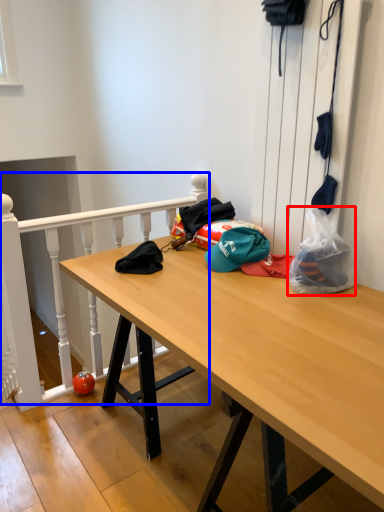
Question: Which object is further to the camera taking this photo, plastic bag (highlighted by a red box) or rail (highlighted by a blue box)?

Choices:
 (A) plastic bag
 (B) rail

Answer: (B)